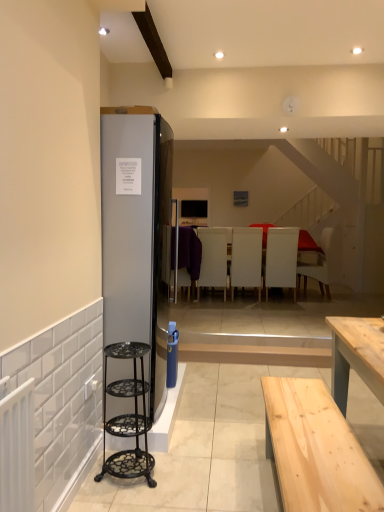
Question: Is there a large distance between purple fabric armchair at center, arranged as the fifth armchair when viewed from the right, and white leather armchair at center, the 3th armchair in the right-to-left sequence?

Choices:
 (A) yes
 (B) no

Answer: (B)

Question: From the image's perspective, does purple fabric armchair at center, the first armchair viewed from the left, appear lower than white leather armchair at center, the 3th armchair in the right-to-left sequence?

Choices:
 (A) no
 (B) yes

Answer: (A)

Question: Is white leather armchair at center, the 3th armchair in the right-to-left sequence, inside purple fabric armchair at center, the first armchair viewed from the left?

Choices:
 (A) yes
 (B) no

Answer: (B)

Question: Is purple fabric armchair at center, arranged as the fifth armchair when viewed from the right, touching white leather armchair at center, the third armchair from the left?

Choices:
 (A) yes
 (B) no

Answer: (B)

Question: Can you confirm if purple fabric armchair at center, arranged as the fifth armchair when viewed from the right, is wider than white leather armchair at center, the third armchair from the left?

Choices:
 (A) no
 (B) yes

Answer: (A)

Question: In terms of width, does white leather armchair at center, the second armchair positioned from the right, look wider or thinner when compared to white fabric armchair at center, which is counted as the fifth armchair, starting from the left?

Choices:
 (A) wide
 (B) thin

Answer: (B)

Question: In terms of size, does white leather armchair at center, the second armchair positioned from the right, appear bigger or smaller than white fabric armchair at center, the 1th armchair when ordered from right to left?

Choices:
 (A) big
 (B) small

Answer: (B)

Question: Based on their positions, is white leather armchair at center, which appears as the fourth armchair when viewed from the left, located to the left or right of white fabric armchair at center, the 1th armchair when ordered from right to left?

Choices:
 (A) left
 (B) right

Answer: (A)

Question: Considering the positions of point (269, 261) and point (319, 284), is point (269, 261) closer or farther from the camera than point (319, 284)?

Choices:
 (A) farther
 (B) closer

Answer: (A)

Question: From a real-world perspective, is purple fabric armchair at center, arranged as the fifth armchair when viewed from the right, above or below satin silver refrigerator at left?

Choices:
 (A) above
 (B) below

Answer: (B)

Question: Based on their positions, is purple fabric armchair at center, the first armchair viewed from the left, located to the left or right of satin silver refrigerator at left?

Choices:
 (A) right
 (B) left

Answer: (A)

Question: From the image's perspective, is purple fabric armchair at center, the first armchair viewed from the left, above or below satin silver refrigerator at left?

Choices:
 (A) above
 (B) below

Answer: (A)

Question: Considering their positions, is purple fabric armchair at center, the first armchair viewed from the left, located in front of or behind satin silver refrigerator at left?

Choices:
 (A) behind
 (B) front

Answer: (A)

Question: Is white fabric armchair at center, which is counted as the fifth armchair, starting from the left, spatially inside satin silver refrigerator at left, or outside of it?

Choices:
 (A) outside
 (B) inside

Answer: (A)

Question: Is white fabric armchair at center, which is counted as the fifth armchair, starting from the left, to the left or to the right of satin silver refrigerator at left in the image?

Choices:
 (A) left
 (B) right

Answer: (B)